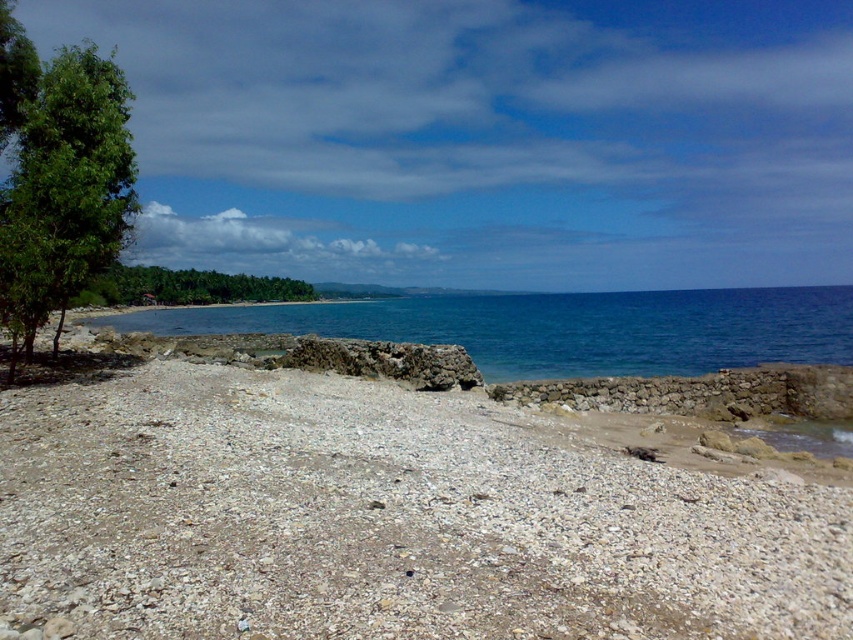
Question: Which point is farther to the camera?

Choices:
 (A) gray gravel beach at center
 (B) green leafy tree at left
 (C) blue clear water at center
 (D) green leafy trees at center

Answer: (C)

Question: Which point appears closest to the camera in this image?

Choices:
 (A) (426, 401)
 (B) (813, 305)
 (C) (71, 112)

Answer: (C)

Question: Estimate the real-world distances between objects in this image. Which object is closer to the green leafy tree at left?

Choices:
 (A) gray gravel beach at center
 (B) blue clear water at center

Answer: (A)

Question: Can you confirm if blue clear water at center is thinner than green leafy trees at center?

Choices:
 (A) no
 (B) yes

Answer: (A)

Question: Can you confirm if gray gravel beach at center is positioned below green leafy trees at center?

Choices:
 (A) yes
 (B) no

Answer: (A)

Question: Where is green leafy tree at left located in relation to green leafy trees at center in the image?

Choices:
 (A) above
 (B) below

Answer: (B)